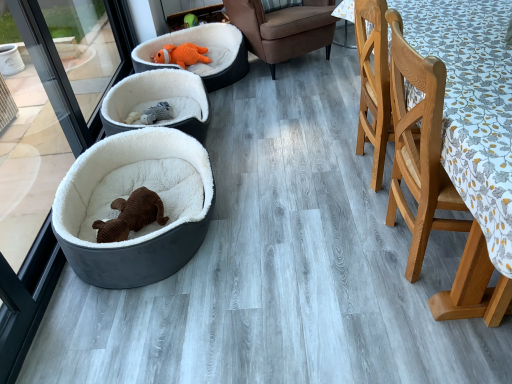
Where is `orange plush toy at upper center`? This screenshot has height=384, width=512. orange plush toy at upper center is located at coordinates tap(182, 55).

Find the location of a particular element. brown fabric armchair at center, acting as the 1th chair starting from the top is located at coordinates (283, 28).

Is white plush dog bed at center, the 2th dog bed when ordered from back to front, not inside velvet brown dog bed at left, acting as the 3th dog bed starting from the back?

white plush dog bed at center, the 2th dog bed when ordered from back to front, lies outside velvet brown dog bed at left, acting as the 3th dog bed starting from the back,'s area.

Is white plush dog bed at center, the 2th dog bed viewed from the front, not near velvet brown dog bed at left, which is counted as the first dog bed, starting from the front?

Actually, white plush dog bed at center, the 2th dog bed viewed from the front, and velvet brown dog bed at left, which is counted as the first dog bed, starting from the front, are a little close together.

From the picture: Is white plush dog bed at center, the 2th dog bed viewed from the front, turned away from velvet brown dog bed at left, which is counted as the first dog bed, starting from the front?

No, white plush dog bed at center, the 2th dog bed viewed from the front, is not facing the opposite direction of velvet brown dog bed at left, which is counted as the first dog bed, starting from the front.

From the image's perspective, between light brown wooden chair at right, the second chair viewed from the back, and orange plush dog bed at upper center, which appears as the 3th dog bed when viewed from the front, which one is located above?

orange plush dog bed at upper center, which appears as the 3th dog bed when viewed from the front, from the image's perspective.

Would you say light brown wooden chair at right, which is the first chair in front-to-back order, is inside or outside orange plush dog bed at upper center, arranged as the 1th dog bed when viewed from the back?

light brown wooden chair at right, which is the first chair in front-to-back order, is not inside orange plush dog bed at upper center, arranged as the 1th dog bed when viewed from the back, it's outside.

The image size is (512, 384). Find the location of `chair below the orange plush dog bed at upper center, which appears as the 3th dog bed when viewed from the front (from the image's perspective)`. chair below the orange plush dog bed at upper center, which appears as the 3th dog bed when viewed from the front (from the image's perspective) is located at coordinates (435, 188).

In terms of width, does light brown wooden chair at right, which is the first chair in front-to-back order, look wider or thinner when compared to orange plush dog bed at upper center, arranged as the 1th dog bed when viewed from the back?

light brown wooden chair at right, which is the first chair in front-to-back order, is thinner than orange plush dog bed at upper center, arranged as the 1th dog bed when viewed from the back.

Which dog bed is the 3rd one when counting from the left side of the brown fabric armchair at center, the 2th chair positioned from the front? Please provide its 2D coordinates.

[(158, 101)]

Does white plush dog bed at center, the 2th dog bed viewed from the front, have a greater height compared to brown fabric armchair at center, the 2th chair positioned from the front?

No, white plush dog bed at center, the 2th dog bed viewed from the front, is not taller than brown fabric armchair at center, the 2th chair positioned from the front.

Could you measure the distance between white plush dog bed at center, the 2th dog bed when ordered from back to front, and brown fabric armchair at center, which is counted as the second chair, starting from the bottom?

83.88 centimeters.

Is white plush dog bed at center, the 2th dog bed when ordered from back to front, facing away from brown fabric armchair at center, the 2th chair positioned from the front?

white plush dog bed at center, the 2th dog bed when ordered from back to front, does not have its back to brown fabric armchair at center, the 2th chair positioned from the front.

Is velvet brown dog bed at left, which is counted as the first dog bed, starting from the front, positioned far away from light brown wooden chair at right, the second chair viewed from the back?

Indeed, velvet brown dog bed at left, which is counted as the first dog bed, starting from the front, is not near light brown wooden chair at right, the second chair viewed from the back.

Is velvet brown dog bed at left, which is counted as the first dog bed, starting from the front, oriented towards light brown wooden chair at right, the 2th chair in the top-to-bottom sequence?

Result: No.

Relative to light brown wooden chair at right, the 2th chair in the top-to-bottom sequence, is velvet brown dog bed at left, which is counted as the first dog bed, starting from the front, in front or behind?

velvet brown dog bed at left, which is counted as the first dog bed, starting from the front, is positioned farther from the viewer than light brown wooden chair at right, the 2th chair in the top-to-bottom sequence.

Which is more to the right, light brown wooden chair at right, the 1th chair when ordered from bottom to top, or orange plush toy at upper center?

light brown wooden chair at right, the 1th chair when ordered from bottom to top.

Does point (413, 49) appear closer or farther from the camera than point (161, 53)?

Point (413, 49) is positioned closer to the camera compared to point (161, 53).

From a real-world perspective, between light brown wooden chair at right, the 2th chair in the top-to-bottom sequence, and orange plush toy at upper center, who is vertically lower?

orange plush toy at upper center, from a real-world perspective.

Can you confirm if velvet brown dog bed at left, acting as the 3th dog bed starting from the back, is bigger than white plush dog bed at center, the 2th dog bed when ordered from back to front?

Indeed, velvet brown dog bed at left, acting as the 3th dog bed starting from the back, has a larger size compared to white plush dog bed at center, the 2th dog bed when ordered from back to front.

Considering the positions of objects velvet brown dog bed at left, acting as the 3th dog bed starting from the back, and white plush dog bed at center, the 2th dog bed viewed from the front, in the image provided, who is behind, velvet brown dog bed at left, acting as the 3th dog bed starting from the back, or white plush dog bed at center, the 2th dog bed viewed from the front,?

white plush dog bed at center, the 2th dog bed viewed from the front.

From a real-world perspective, is velvet brown dog bed at left, which is counted as the first dog bed, starting from the front, above or below white plush dog bed at center, the 2th dog bed viewed from the front?

Clearly, from a real-world perspective, velvet brown dog bed at left, which is counted as the first dog bed, starting from the front, is below white plush dog bed at center, the 2th dog bed viewed from the front.

From the image's perspective, is velvet brown dog bed at left, which is counted as the first dog bed, starting from the front, above or below white plush dog bed at center, the 2th dog bed viewed from the front?

velvet brown dog bed at left, which is counted as the first dog bed, starting from the front, is situated lower than white plush dog bed at center, the 2th dog bed viewed from the front, in the image.

From the image's perspective, is orange plush dog bed at upper center, arranged as the 1th dog bed when viewed from the back, over velvet brown dog bed at left, acting as the 3th dog bed starting from the back?

Correct, orange plush dog bed at upper center, arranged as the 1th dog bed when viewed from the back, appears higher than velvet brown dog bed at left, acting as the 3th dog bed starting from the back, in the image.

Would you say orange plush dog bed at upper center, arranged as the 1th dog bed when viewed from the back, is to the left or to the right of velvet brown dog bed at left, which is counted as the first dog bed, starting from the front, in the picture?

From the image, it's evident that orange plush dog bed at upper center, arranged as the 1th dog bed when viewed from the back, is to the right of velvet brown dog bed at left, which is counted as the first dog bed, starting from the front.

Does orange plush dog bed at upper center, arranged as the 1th dog bed when viewed from the back, have a greater height compared to velvet brown dog bed at left, which is counted as the first dog bed, starting from the front?

Yes.

Locate an element on the screen. dog bed that is the 1st object above the velvet brown dog bed at left, which is counted as the first dog bed, starting from the front (from a real-world perspective) is located at coordinates (158, 101).

Locate an element on the screen. chair that is below the orange plush dog bed at upper center, which appears as the 3th dog bed when viewed from the front (from the image's perspective) is located at coordinates (435, 188).

Estimate the real-world distances between objects in this image. Which object is further from brown fabric armchair at center, the 2th chair positioned from the front, velvet brown dog bed at left, which is counted as the first dog bed, starting from the front, or orange plush toy at upper center?

velvet brown dog bed at left, which is counted as the first dog bed, starting from the front.

Estimate the real-world distances between objects in this image. Which object is further from light brown wooden chair at right, which is the first chair in front-to-back order, brown fabric armchair at center, which is counted as the second chair, starting from the bottom, or orange plush toy at upper center?

orange plush toy at upper center.

From the image, which object appears to be farther from white plush dog bed at center, the 2th dog bed when ordered from back to front, light brown wooden chair at right, the 1th chair when ordered from bottom to top, or orange plush dog bed at upper center, which appears as the 3th dog bed when viewed from the front?

Among the two, light brown wooden chair at right, the 1th chair when ordered from bottom to top, is located further to white plush dog bed at center, the 2th dog bed when ordered from back to front.

Based on the photo, when comparing their distances from light brown wooden chair at right, which is the first chair in front-to-back order, does velvet brown dog bed at left, acting as the 3th dog bed starting from the back, or orange plush toy at upper center seem further?

The object further to light brown wooden chair at right, which is the first chair in front-to-back order, is orange plush toy at upper center.

From the image, which object appears to be farther from brown fabric armchair at center, the first chair positioned from the back, light brown wooden chair at right, the 1th chair when ordered from bottom to top, or orange plush toy at upper center?

light brown wooden chair at right, the 1th chair when ordered from bottom to top, is positioned further to the anchor brown fabric armchair at center, the first chair positioned from the back.

When comparing their distances from velvet brown dog bed at left, which is counted as the first dog bed, starting from the front, does orange plush dog bed at upper center, arranged as the 1th dog bed when viewed from the back, or white plush dog bed at center, the 2th dog bed when ordered from back to front, seem further?

orange plush dog bed at upper center, arranged as the 1th dog bed when viewed from the back, is positioned further to the anchor velvet brown dog bed at left, which is counted as the first dog bed, starting from the front.

Looking at this image, based on their spatial positions, is orange plush toy at upper center or white plush dog bed at center, the 2th dog bed viewed from the front, closer to velvet brown dog bed at left, which is counted as the first dog bed, starting from the front?

Among the two, white plush dog bed at center, the 2th dog bed viewed from the front, is located nearer to velvet brown dog bed at left, which is counted as the first dog bed, starting from the front.

From the image, which object appears to be farther from velvet brown dog bed at left, acting as the 3th dog bed starting from the back, white plush dog bed at center, the 2th dog bed when ordered from back to front, or light brown wooden chair at right, the 2th chair in the top-to-bottom sequence?

Answer: light brown wooden chair at right, the 2th chair in the top-to-bottom sequence.

Where is `chair between velvet brown dog bed at left, which is counted as the first dog bed, starting from the front, and orange plush toy at upper center from front to back`? chair between velvet brown dog bed at left, which is counted as the first dog bed, starting from the front, and orange plush toy at upper center from front to back is located at coordinates (283, 28).

At what (x,y) coordinates should I click in order to perform the action: click on dog bed between brown fabric armchair at center, which is counted as the second chair, starting from the bottom, and white plush dog bed at center, the 2th dog bed viewed from the front, from top to bottom. Please return your answer as a coordinate pair (x, y). Looking at the image, I should click on (206, 54).

The height and width of the screenshot is (384, 512). I want to click on chair between light brown wooden chair at right, the 1th chair when ordered from bottom to top, and orange plush dog bed at upper center, which appears as the 3th dog bed when viewed from the front, from front to back, so click(x=283, y=28).

Find the location of `chair located between white plush dog bed at center, the 2th dog bed viewed from the front, and orange plush toy at upper center in the depth direction`. chair located between white plush dog bed at center, the 2th dog bed viewed from the front, and orange plush toy at upper center in the depth direction is located at coordinates (283, 28).